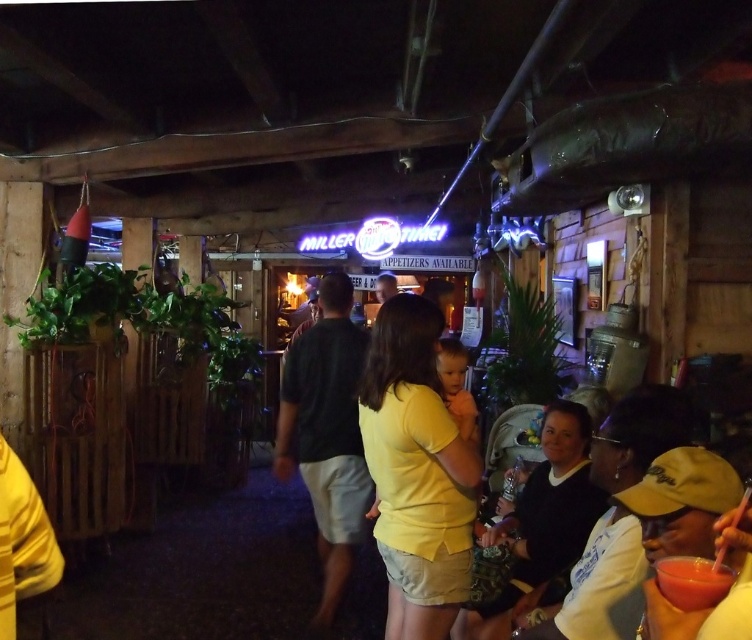
Question: Can you confirm if yellow matte shirt at center is positioned to the left of smooth matte red drink at lower right?

Choices:
 (A) no
 (B) yes

Answer: (B)

Question: In this image, where is yellow matte shirt at center located relative to smooth matte red drink at lower right?

Choices:
 (A) left
 (B) right

Answer: (A)

Question: Which point is closer to the camera taking this photo?

Choices:
 (A) (672, 580)
 (B) (387, 358)

Answer: (A)

Question: Which point is closer to the camera?

Choices:
 (A) (450, 486)
 (B) (699, 604)

Answer: (B)

Question: Does yellow matte shirt at center appear on the right side of smooth matte red drink at lower right?

Choices:
 (A) no
 (B) yes

Answer: (A)